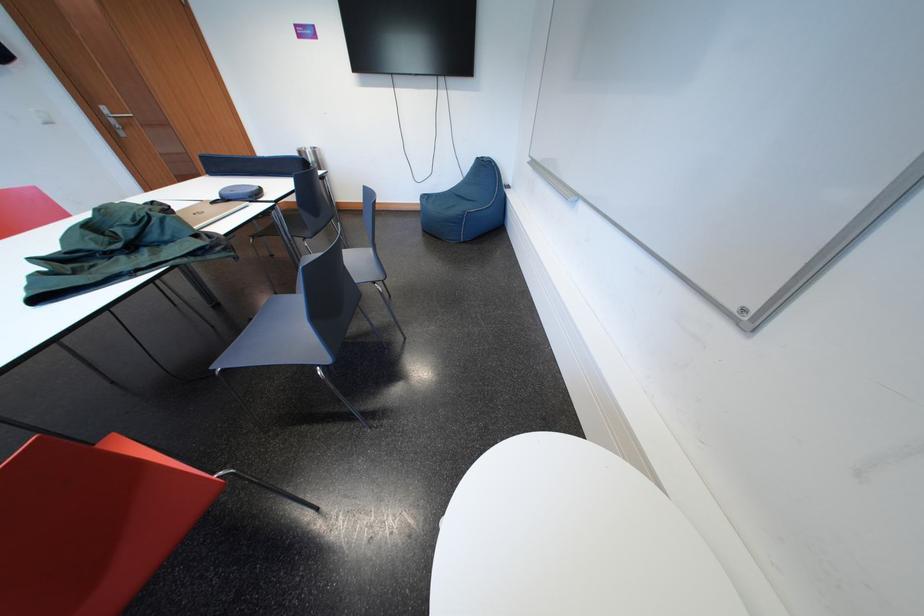
Locate an element on the screen. red chair sitting surface is located at coordinates (141, 452).